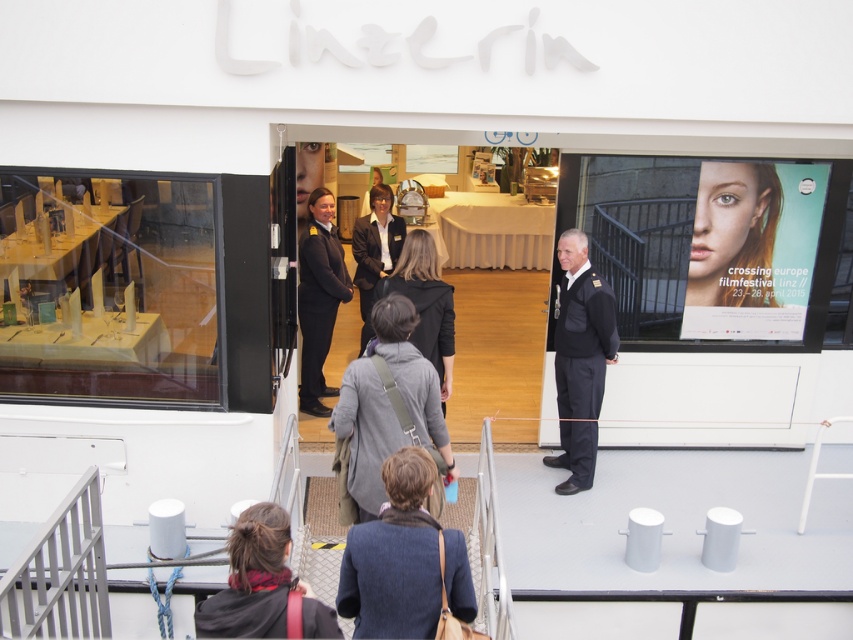
You are a photographer at the film festival event. You need to capture a photo of the brown hair at lower center and the dark gray wool business suit at center. Which person should you focus on first if you want to include both in the frame without moving the camera?

The brown hair at lower center is shorter than the dark gray wool business suit at center, so you should focus on the brown hair at lower center first to ensure both are in frame.

You are standing on the deck of the ship at the Crossing Europe Filmfestival Linz. There are two points marked on the deck, one at coordinates point (440, 540) and another at point (744, 204). Which point is closer to you?

Point (440, 540) is closer to the viewer than point (744, 204).